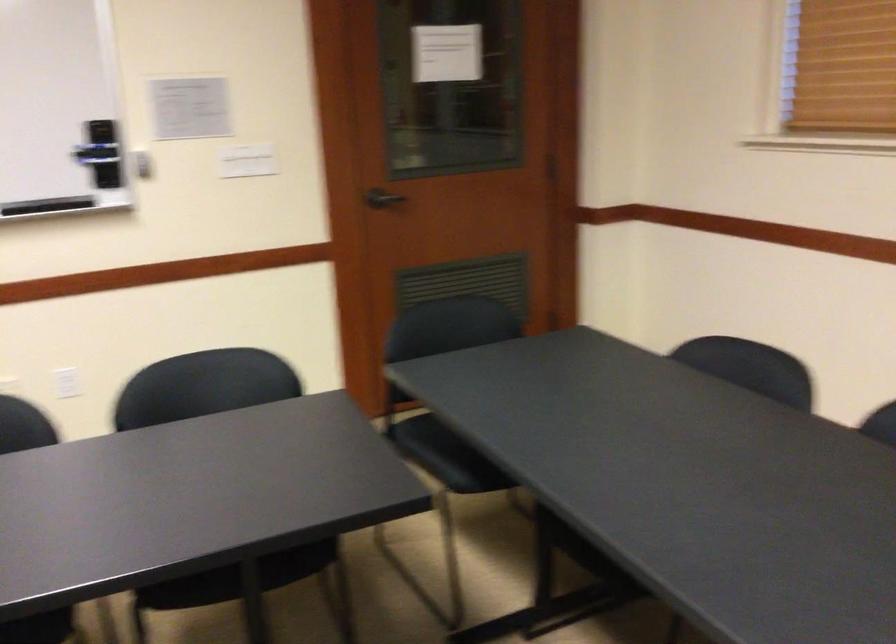
Where is `white light switch`? The image size is (896, 644). white light switch is located at coordinates (66, 383).